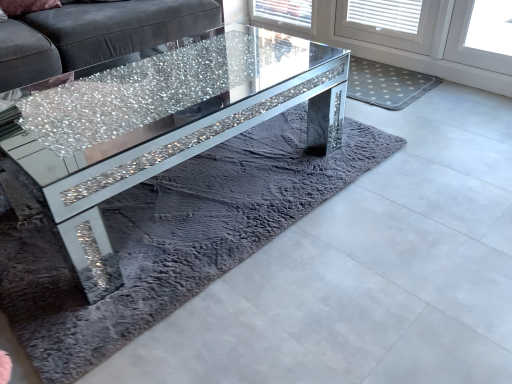
Measure the distance between point [151,68] and camera.

Point [151,68] is 1.46 meters away from camera.

This screenshot has height=384, width=512. Describe the element at coordinates (165, 125) in the screenshot. I see `crystalline glass coffee table at center` at that location.

Identify the location of crystalline glass coffee table at center. (165, 125).

Image resolution: width=512 pixels, height=384 pixels. What do you see at coordinates (162, 87) in the screenshot? I see `sparkly glass table at center` at bounding box center [162, 87].

What is the approximate width of sparkly glass table at center?

sparkly glass table at center is 3.30 feet in width.

Locate an element on the screen. The height and width of the screenshot is (384, 512). sparkly glass table at center is located at coordinates (162, 87).

Identify the location of crystalline glass coffee table at center. (165, 125).

Considering the positions of objects sparkly glass table at center and crystalline glass coffee table at center in the image provided, who is more to the right, sparkly glass table at center or crystalline glass coffee table at center?

From the viewer's perspective, crystalline glass coffee table at center appears more on the right side.

Between sparkly glass table at center and crystalline glass coffee table at center, which one is positioned behind?

sparkly glass table at center is more distant.

Between point (214, 50) and point (96, 202), which one is positioned behind?

Point (214, 50)

From the image's perspective, which one is positioned lower, sparkly glass table at center or crystalline glass coffee table at center?

crystalline glass coffee table at center.

Consider the image. From a real-world perspective, is sparkly glass table at center located higher than crystalline glass coffee table at center?

Yes, from a real-world perspective, sparkly glass table at center is above crystalline glass coffee table at center.

Is sparkly glass table at center wider or thinner than crystalline glass coffee table at center?

Clearly, sparkly glass table at center has more width compared to crystalline glass coffee table at center.

Is sparkly glass table at center taller or shorter than crystalline glass coffee table at center?

In the image, sparkly glass table at center appears to be taller than crystalline glass coffee table at center.

Does sparkly glass table at center have a larger size compared to crystalline glass coffee table at center?

Correct, sparkly glass table at center is larger in size than crystalline glass coffee table at center.

Is sparkly glass table at center inside the boundaries of crystalline glass coffee table at center, or outside?

sparkly glass table at center is located beyond the bounds of crystalline glass coffee table at center.

Can you see sparkly glass table at center touching crystalline glass coffee table at center?

Yes, the surface of sparkly glass table at center is in contact with crystalline glass coffee table at center.

Is sparkly glass table at center oriented away from crystalline glass coffee table at center?

sparkly glass table at center is not turned away from crystalline glass coffee table at center.

Where is `coffee table located on the right of sparkly glass table at center`? coffee table located on the right of sparkly glass table at center is located at coordinates (165, 125).

Which is more to the left, crystalline glass coffee table at center or sparkly glass table at center?

Positioned to the left is sparkly glass table at center.

Consider the image. Which object is closer to the camera taking this photo, crystalline glass coffee table at center or sparkly glass table at center?

crystalline glass coffee table at center is closer to the camera.

Which is nearer, (151,132) or (121,100)?

The point (121,100) is closer.

From the image's perspective, does crystalline glass coffee table at center appear higher than sparkly glass table at center?

No, from the image's perspective, crystalline glass coffee table at center is not above sparkly glass table at center.

From a real-world perspective, which object stands above the other?

sparkly glass table at center.

Considering the sizes of crystalline glass coffee table at center and sparkly glass table at center in the image, is crystalline glass coffee table at center wider or thinner than sparkly glass table at center?

Considering their sizes, crystalline glass coffee table at center looks slimmer than sparkly glass table at center.

Can you confirm if crystalline glass coffee table at center is shorter than sparkly glass table at center?

Yes.

Who is bigger, crystalline glass coffee table at center or sparkly glass table at center?

sparkly glass table at center is bigger.

Is crystalline glass coffee table at center surrounding sparkly glass table at center?

No, sparkly glass table at center is not inside crystalline glass coffee table at center.

Is crystalline glass coffee table at center in contact with sparkly glass table at center?

Yes, crystalline glass coffee table at center and sparkly glass table at center clearly make contact.

Is crystalline glass coffee table at center facing towards sparkly glass table at center?

No, crystalline glass coffee table at center is not turned towards sparkly glass table at center.

Where is `coffee table in front of the sparkly glass table at center`? The image size is (512, 384). coffee table in front of the sparkly glass table at center is located at coordinates (165, 125).

Where is `coffee table in front of the sparkly glass table at center`? coffee table in front of the sparkly glass table at center is located at coordinates (165, 125).

Find the location of a particular element. coffee table to the right of sparkly glass table at center is located at coordinates (165, 125).